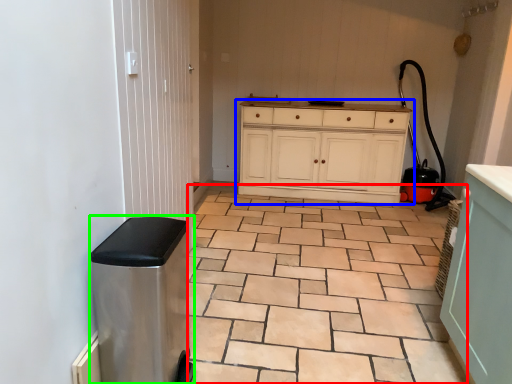
Question: Based on their relative distances, which object is nearer to ceramic tile (highlighted by a red box)? Choose from chest of drawers (highlighted by a blue box) and water heater (highlighted by a green box).

Choices:
 (A) chest of drawers
 (B) water heater

Answer: (B)